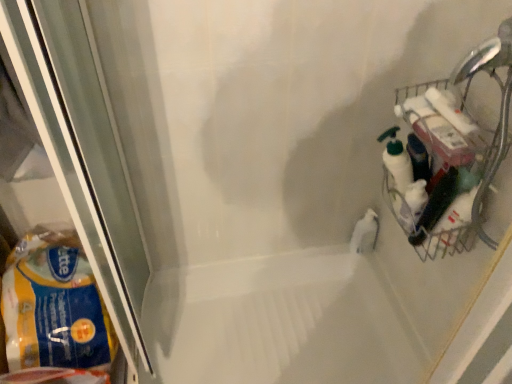
In order to click on white glossy bottle at center in this screenshot , I will do `click(365, 233)`.

Describe the element at coordinates (54, 305) in the screenshot. I see `yellow plastic bag at left` at that location.

What is the approximate width of metallic wire basket at right?

6.01 inches.

Find the location of `white glossy bottle at center`. white glossy bottle at center is located at coordinates (365, 233).

From a real-world perspective, is white glossy bath at center located beneath white glossy bottle at center?

Yes, from a real-world perspective, white glossy bath at center is below white glossy bottle at center.

Which of these two, white glossy bath at center or white glossy bottle at center, stands taller?

white glossy bath at center.

Is white glossy bath at center smaller than white glossy bottle at center?

No.

Consider the image. Is white glossy bath at center positioned beyond the bounds of white glossy bottle at center?

Yes, white glossy bath at center is not within white glossy bottle at center.

Is white glossy bottle at center oriented towards yellow plastic bag at left?

Yes.

From a real-world perspective, is white glossy bottle at center on top of yellow plastic bag at left?

No.

Does white glossy bottle at center have a greater height compared to yellow plastic bag at left?

No, white glossy bottle at center is not taller than yellow plastic bag at left.

Where is `cleaning product above the yellow plastic bag at left (from the image's perspective)`? cleaning product above the yellow plastic bag at left (from the image's perspective) is located at coordinates (365, 233).

Locate an element on the screen. basket above the white glossy bath at center (from the image's perspective) is located at coordinates (436, 173).

Would you say metallic wire basket at right contains white glossy bath at center?

No, white glossy bath at center is not surrounded by metallic wire basket at right.

Which of these two, metallic wire basket at right or white glossy bath at center, is bigger?

white glossy bath at center is bigger.

Is metallic wire basket at right facing towards white glossy bottle at center?

No, metallic wire basket at right is not facing towards white glossy bottle at center.

Can we say metallic wire basket at right lies outside white glossy bottle at center?

Yes, metallic wire basket at right is not within white glossy bottle at center.

From the image's perspective, is metallic wire basket at right beneath white glossy bottle at center?

No.

Is metallic wire basket at right not near white glossy bottle at center?

Actually, metallic wire basket at right and white glossy bottle at center are a little close together.

Considering the points (327, 375) and (79, 357), which point is in front, point (327, 375) or point (79, 357)?

The point (79, 357) is in front.

Can you confirm if white glossy bath at center is positioned to the right of yellow plastic bag at left?

Indeed, white glossy bath at center is positioned on the right side of yellow plastic bag at left.

Does white glossy bath at center contain yellow plastic bag at left?

No, yellow plastic bag at left is not inside white glossy bath at center.

In terms of width, does white glossy bath at center look wider or thinner when compared to yellow plastic bag at left?

Clearly, white glossy bath at center has more width compared to yellow plastic bag at left.

Considering the positions of point (24, 340) and point (276, 322), is point (24, 340) closer or farther from the camera than point (276, 322)?

Point (24, 340) appears to be closer to the viewer than point (276, 322).

In terms of width, does yellow plastic bag at left look wider or thinner when compared to white glossy bath at center?

Considering their sizes, yellow plastic bag at left looks slimmer than white glossy bath at center.

Considering the relative sizes of yellow plastic bag at left and metallic wire basket at right in the image provided, is yellow plastic bag at left bigger than metallic wire basket at right?

Indeed, yellow plastic bag at left has a larger size compared to metallic wire basket at right.

Is yellow plastic bag at left far away from metallic wire basket at right?

No, there isn't a large distance between yellow plastic bag at left and metallic wire basket at right.

Is point (35, 275) positioned behind point (432, 142)?

Yes, it is.

In terms of height, does yellow plastic bag at left look taller or shorter compared to metallic wire basket at right?

yellow plastic bag at left is shorter than metallic wire basket at right.

Find the location of a particular element. The width and height of the screenshot is (512, 384). cleaning product lying above the white glossy bath at center (from the image's perspective) is located at coordinates (365, 233).

I want to click on cleaning product located behind the yellow plastic bag at left, so tap(365, 233).

From the image, which object appears to be nearer to white glossy bottle at center, yellow plastic bag at left or metallic wire basket at right?

metallic wire basket at right.

From the image, which object appears to be farther from yellow plastic bag at left, white glossy bottle at center or white glossy bath at center?

The object further to yellow plastic bag at left is white glossy bottle at center.

Looking at the image, which one is located further to white glossy bottle at center, yellow plastic bag at left or white glossy bath at center?

yellow plastic bag at left is positioned further to the anchor white glossy bottle at center.

When comparing their distances from yellow plastic bag at left, does white glossy bath at center or metallic wire basket at right seem further?

metallic wire basket at right.

Which object lies further to the anchor point white glossy bath at center, white glossy bottle at center or yellow plastic bag at left?

yellow plastic bag at left lies further to white glossy bath at center than the other object.

Considering their positions, is yellow plastic bag at left positioned further to metallic wire basket at right than white glossy bottle at center?

yellow plastic bag at left is positioned further to the anchor metallic wire basket at right.

Based on their spatial positions, is white glossy bottle at center or metallic wire basket at right closer to white glossy bath at center?

white glossy bottle at center is positioned closer to the anchor white glossy bath at center.

When comparing their distances from yellow plastic bag at left, does metallic wire basket at right or white glossy bottle at center seem closer?

The object closer to yellow plastic bag at left is metallic wire basket at right.

Image resolution: width=512 pixels, height=384 pixels. I want to click on bath between yellow plastic bag at left and metallic wire basket at right in the horizontal direction, so click(x=280, y=321).

Find the location of a particular element. The height and width of the screenshot is (384, 512). bath between metallic wire basket at right and white glossy bottle at center along the z-axis is located at coordinates (280, 321).

In order to click on bath between yellow plastic bag at left and white glossy bottle at center from left to right in this screenshot , I will do `click(280, 321)`.

Locate an element on the screen. The image size is (512, 384). basket situated between yellow plastic bag at left and white glossy bottle at center from left to right is located at coordinates (436, 173).